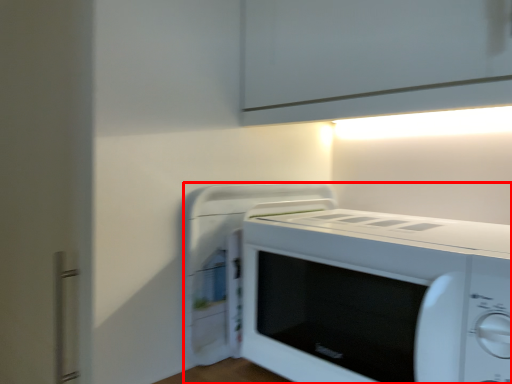
Question: Where is home appliance (annotated by the red box) located in relation to appliance in the image?

Choices:
 (A) right
 (B) left

Answer: (A)